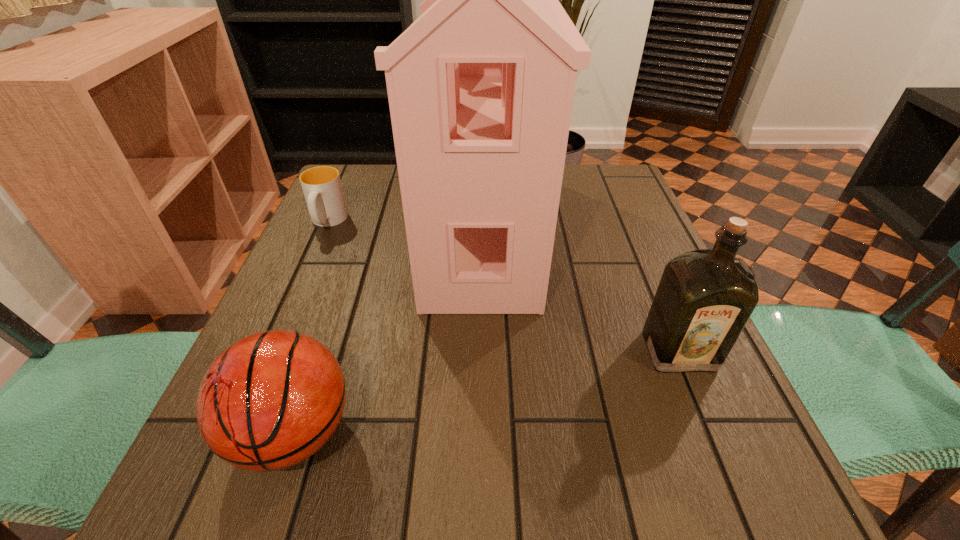
Find the location of `vacant area at the near edge`. vacant area at the near edge is located at coordinates (470, 502).

Locate an element on the screen. vacant space at the left edge of the desktop is located at coordinates (355, 266).

Where is `vacant area at the right edge of the desktop`? The image size is (960, 540). vacant area at the right edge of the desktop is located at coordinates (726, 434).

The height and width of the screenshot is (540, 960). In order to click on free location at the far left corner in this screenshot , I will do `click(354, 204)`.

The height and width of the screenshot is (540, 960). What are the coordinates of `vacant space at the far right corner` in the screenshot? It's located at tap(623, 208).

I want to click on vacant area between the shortest object and the dollhouse, so click(x=404, y=225).

The width and height of the screenshot is (960, 540). What are the coordinates of `vacant space that's between the dollhouse and the cup` in the screenshot? It's located at (404, 225).

Where is `vacant space that is in between the second shortest object and the liquor`? This screenshot has height=540, width=960. vacant space that is in between the second shortest object and the liquor is located at coordinates pos(487,392).

Where is `free point between the basketball and the shortest object`? The width and height of the screenshot is (960, 540). free point between the basketball and the shortest object is located at coordinates (311, 327).

Locate an element on the screen. The width and height of the screenshot is (960, 540). unoccupied position between the tallest object and the shortest object is located at coordinates (404, 225).